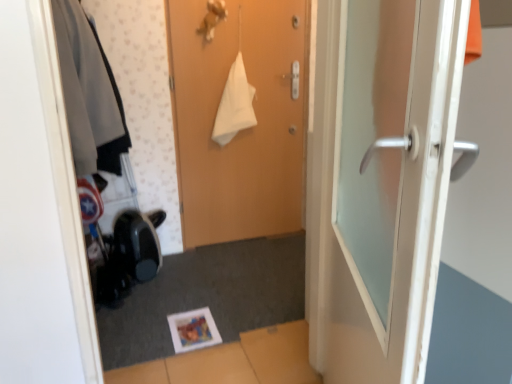
In order to face matte gray jacket at left, should I rotate leftwards or rightwards?

You should rotate left by 21.326 degrees.

Consider the image. Measure the distance between point (x=361, y=65) and camera.

The distance of point (x=361, y=65) from camera is 3.55 feet.

What is the approximate width of white glossy door at right, arranged as the second door when viewed from the back?

white glossy door at right, arranged as the second door when viewed from the back, is 7.70 inches wide.

I want to click on matte gray jacket at left, so click(89, 93).

How far apart are white glossy door at right, the first door in the front-to-back sequence, and matte gray jacket at left?

The distance of white glossy door at right, the first door in the front-to-back sequence, from matte gray jacket at left is 3.74 feet.

Looking at this image, is white glossy door at right, the first door in the front-to-back sequence, to the left or to the right of matte gray jacket at left in the image?

Based on their positions, white glossy door at right, the first door in the front-to-back sequence, is located to the right of matte gray jacket at left.

Is white glossy door at right, arranged as the second door when viewed from the back, placed right next to matte gray jacket at left?

No, white glossy door at right, arranged as the second door when viewed from the back, is not next to matte gray jacket at left.

Considering the positions of objects white glossy door at right, the first door in the front-to-back sequence, and matte gray jacket at left in the image provided, who is in front, white glossy door at right, the first door in the front-to-back sequence, or matte gray jacket at left?

white glossy door at right, the first door in the front-to-back sequence, is closer to the camera.

Does white glossy door at right, arranged as the second door when viewed from the back, have a larger size compared to wooden door at center, the first door in the back-to-front sequence?

Yes.

Identify the location of door above the white glossy door at right, the first door in the front-to-back sequence (from a real-world perspective). The height and width of the screenshot is (384, 512). (243, 130).

From the image's perspective, between white glossy door at right, the first door in the front-to-back sequence, and wooden door at center, which is counted as the 2th door, starting from the front, who is located below?

From the image's view, white glossy door at right, the first door in the front-to-back sequence, is below.

Which is less distant, [324,272] or [254,186]?

Point [324,272] is positioned closer to the camera compared to point [254,186].

From the picture: In terms of size, does matte gray jacket at left appear bigger or smaller than wooden door at center, the first door in the back-to-front sequence?

Clearly, matte gray jacket at left is larger in size than wooden door at center, the first door in the back-to-front sequence.

What's the angular difference between matte gray jacket at left and wooden door at center, the first door in the back-to-front sequence,'s facing directions?

The angle between the facing direction of matte gray jacket at left and the facing direction of wooden door at center, the first door in the back-to-front sequence, is 2.19 degrees.

From a real-world perspective, is matte gray jacket at left positioned above or below wooden door at center, the first door in the back-to-front sequence?

From a real-world perspective, matte gray jacket at left is physically above wooden door at center, the first door in the back-to-front sequence.

Can wooden door at center, which is counted as the 2th door, starting from the front, be found inside matte gray jacket at left?

No, wooden door at center, which is counted as the 2th door, starting from the front, is not surrounded by matte gray jacket at left.

Is wooden door at center, the first door in the back-to-front sequence, situated inside white glossy door at right, the first door in the front-to-back sequence, or outside?

wooden door at center, the first door in the back-to-front sequence, is located beyond the bounds of white glossy door at right, the first door in the front-to-back sequence.

Can you confirm if wooden door at center, the first door in the back-to-front sequence, is thinner than white glossy door at right, arranged as the second door when viewed from the back?

Correct, the width of wooden door at center, the first door in the back-to-front sequence, is less than that of white glossy door at right, arranged as the second door when viewed from the back.

From a real-world perspective, does wooden door at center, which is counted as the 2th door, starting from the front, stand above white glossy door at right, the first door in the front-to-back sequence?

Yes, from a real-world perspective, wooden door at center, which is counted as the 2th door, starting from the front, is on top of white glossy door at right, the first door in the front-to-back sequence.

Which point is more forward, (231, 202) or (378, 355)?

The point (378, 355) is in front.

Which of these two, wooden door at center, the first door in the back-to-front sequence, or matte gray jacket at left, is smaller?

Smaller between the two is wooden door at center, the first door in the back-to-front sequence.

Considering their positions, is wooden door at center, which is counted as the 2th door, starting from the front, located in front of or behind matte gray jacket at left?

Clearly, wooden door at center, which is counted as the 2th door, starting from the front, is behind matte gray jacket at left.

Is wooden door at center, the first door in the back-to-front sequence, at the right side of matte gray jacket at left?

Correct, you'll find wooden door at center, the first door in the back-to-front sequence, to the right of matte gray jacket at left.

Is matte gray jacket at left facing away from white glossy door at right, arranged as the second door when viewed from the back?

No, matte gray jacket at left is not facing the opposite direction of white glossy door at right, arranged as the second door when viewed from the back.

Is matte gray jacket at left shorter than white glossy door at right, arranged as the second door when viewed from the back?

Correct, matte gray jacket at left is not as tall as white glossy door at right, arranged as the second door when viewed from the back.

Is matte gray jacket at left completely or partially outside of white glossy door at right, the first door in the front-to-back sequence?

Absolutely, matte gray jacket at left is external to white glossy door at right, the first door in the front-to-back sequence.

From the image's perspective, between matte gray jacket at left and white glossy door at right, arranged as the second door when viewed from the back, who is located below?

white glossy door at right, arranged as the second door when viewed from the back, appears lower in the image.

Which door is the 2nd one when counting from the right side of the matte gray jacket at left? Please provide its 2D coordinates.

[(380, 182)]

Where is `door located behind the white glossy door at right, the first door in the front-to-back sequence`? The image size is (512, 384). door located behind the white glossy door at right, the first door in the front-to-back sequence is located at coordinates (243, 130).

When comparing their distances from white glossy door at right, arranged as the second door when viewed from the back, does matte gray jacket at left or wooden door at center, which is counted as the 2th door, starting from the front, seem further?

wooden door at center, which is counted as the 2th door, starting from the front, is further to white glossy door at right, arranged as the second door when viewed from the back.

Which object lies further to the anchor point wooden door at center, the first door in the back-to-front sequence, white glossy door at right, the first door in the front-to-back sequence, or matte gray jacket at left?

white glossy door at right, the first door in the front-to-back sequence, is further to wooden door at center, the first door in the back-to-front sequence.

Looking at the image, which one is located closer to white glossy door at right, the first door in the front-to-back sequence, wooden door at center, the first door in the back-to-front sequence, or matte gray jacket at left?

matte gray jacket at left lies closer to white glossy door at right, the first door in the front-to-back sequence, than the other object.

From the image, which object appears to be farther from matte gray jacket at left, wooden door at center, which is counted as the 2th door, starting from the front, or white glossy door at right, arranged as the second door when viewed from the back?

Among the two, white glossy door at right, arranged as the second door when viewed from the back, is located further to matte gray jacket at left.

Based on their spatial positions, is white glossy door at right, the first door in the front-to-back sequence, or wooden door at center, the first door in the back-to-front sequence, closer to matte gray jacket at left?

wooden door at center, the first door in the back-to-front sequence, is closer to matte gray jacket at left.

Based on their spatial positions, is matte gray jacket at left or white glossy door at right, arranged as the second door when viewed from the back, closer to wooden door at center, which is counted as the 2th door, starting from the front?

matte gray jacket at left is closer to wooden door at center, which is counted as the 2th door, starting from the front.

Find the location of a particular element. The image size is (512, 384). clothing between white glossy door at right, arranged as the second door when viewed from the back, and wooden door at center, which is counted as the 2th door, starting from the front, in the front-back direction is located at coordinates (89, 93).